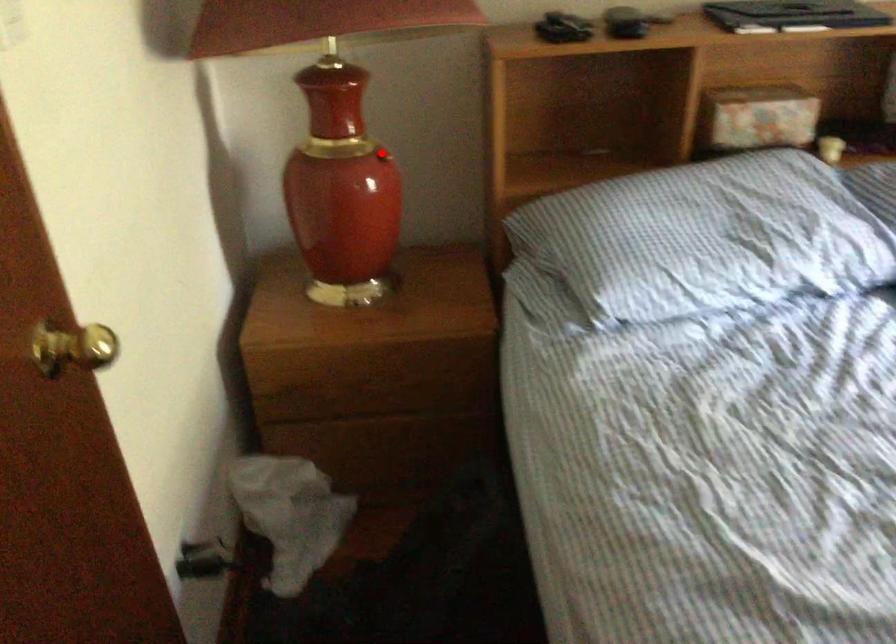
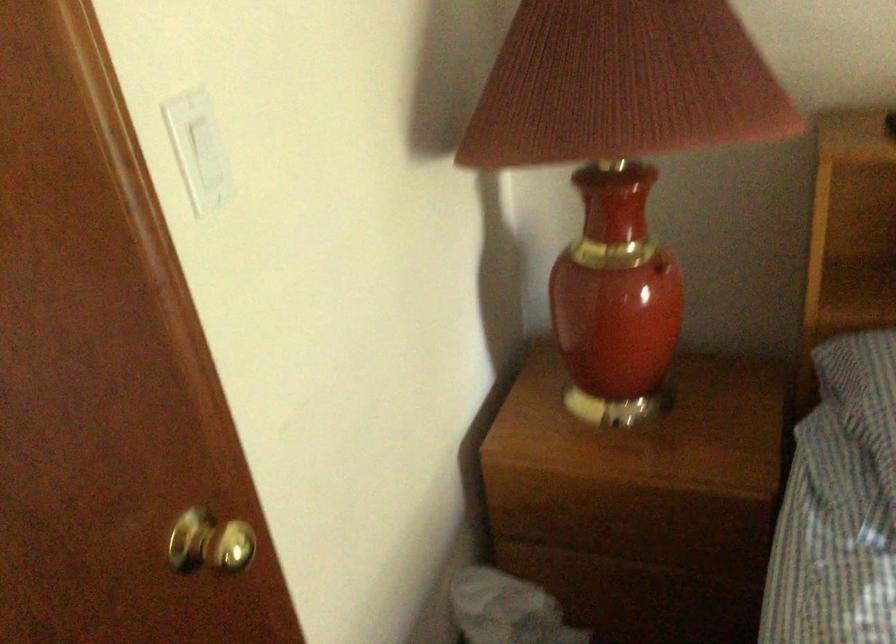
Question: I am providing you with two images of the same scene from different viewpoints. Image1 has a red point marked. In image2, the corresponding 3D location appears at what relative position? Reply with the corresponding letter.

Choices:
 (A) Closer
 (B) Farther

Answer: (A)